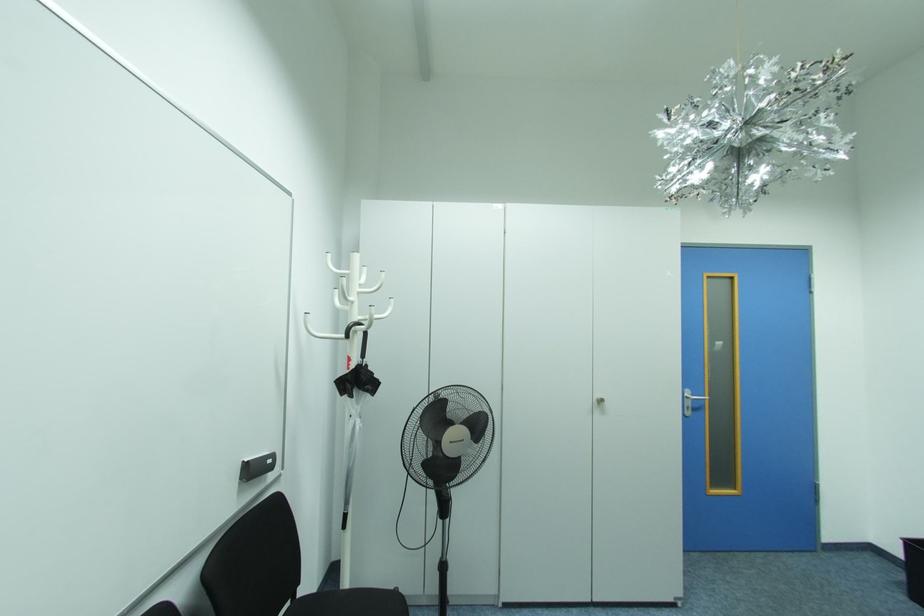
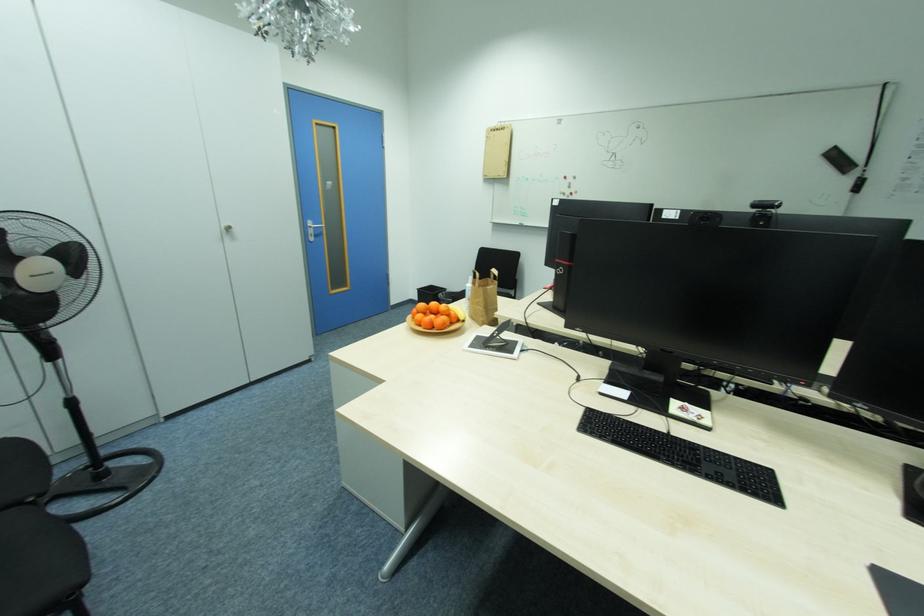
How did the camera likely rotate?

The camera rotated toward right-down.